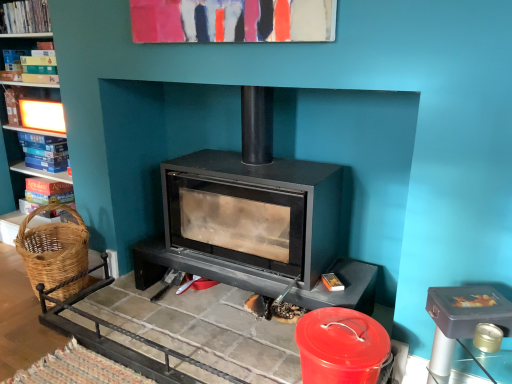
How much space does hardcover book at left, which is counted as the 4th book, starting from the bottom, occupy horizontally?

It is 4.35 inches.

Identify the location of woven brown basket at left. (53, 249).

This screenshot has width=512, height=384. Describe the element at coordinates (44, 152) in the screenshot. I see `blue cardboard book at left, the 2th book when ordered from bottom to top` at that location.

At what (x,y) coordinates should I click in order to perform the action: click on matte cardboard book at left, arranged as the first book when ordered from the bottom. Please return your answer as a coordinate pair (x, y). This screenshot has height=384, width=512. Looking at the image, I should click on (46, 192).

At what (x,y) coordinates should I click in order to perform the action: click on hardcover book at left, the 1th book viewed from the top. Please return your answer as a coordinate pair (x, y). Looking at the image, I should click on (26, 17).

Is matte cardboard book at left, arranged as the first book when ordered from the bottom, outside of blue cardboard book at left, which appears as the third book when viewed from the top?

Yes, matte cardboard book at left, arranged as the first book when ordered from the bottom, is outside of blue cardboard book at left, which appears as the third book when viewed from the top.

Relative to blue cardboard book at left, which appears as the third book when viewed from the top, is matte cardboard book at left, placed as the 4th book when sorted from top to bottom, in front or behind?

Visually, matte cardboard book at left, placed as the 4th book when sorted from top to bottom, is located behind blue cardboard book at left, which appears as the third book when viewed from the top.

Between matte cardboard book at left, arranged as the first book when ordered from the bottom, and blue cardboard book at left, the 2th book when ordered from bottom to top, which one has more height?

Standing taller between the two is blue cardboard book at left, the 2th book when ordered from bottom to top.

Is hardcover book at left, the 2th book viewed from the top, turned away from matte cardboard book at left, placed as the 4th book when sorted from top to bottom?

No, hardcover book at left, the 2th book viewed from the top,'s orientation is not away from matte cardboard book at left, placed as the 4th book when sorted from top to bottom.

Between hardcover book at left, the 2th book viewed from the top, and matte cardboard book at left, arranged as the first book when ordered from the bottom, which one has larger width?

matte cardboard book at left, arranged as the first book when ordered from the bottom, is wider.

Could matte cardboard book at left, placed as the 4th book when sorted from top to bottom, be considered to be inside hardcover book at left, the 2th book viewed from the top?

No, matte cardboard book at left, placed as the 4th book when sorted from top to bottom, is not a part of hardcover book at left, the 2th book viewed from the top.

Considering the relative sizes of hardcover book at left, the 2th book viewed from the top, and matte cardboard book at left, arranged as the first book when ordered from the bottom, in the image provided, is hardcover book at left, the 2th book viewed from the top, taller than matte cardboard book at left, arranged as the first book when ordered from the bottom,?

No.

From the image's perspective, is hardcover book at left, placed as the third book when sorted from bottom to top, located above or below hardcover book at left, which is counted as the 4th book, starting from the bottom?

From the image's perspective, hardcover book at left, placed as the third book when sorted from bottom to top, appears below hardcover book at left, which is counted as the 4th book, starting from the bottom.

Is hardcover book at left, the 1th book viewed from the top, a part of hardcover book at left, the 2th book viewed from the top?

No, hardcover book at left, the 1th book viewed from the top, is not surrounded by hardcover book at left, the 2th book viewed from the top.

Is hardcover book at left, the 2th book viewed from the top, in front of hardcover book at left, the 1th book viewed from the top?

No, hardcover book at left, the 2th book viewed from the top, is further to the viewer.

From a real-world perspective, is hardcover book at left, the 2th book viewed from the top, under hardcover book at left, which is counted as the 4th book, starting from the bottom?

Indeed, from a real-world perspective, hardcover book at left, the 2th book viewed from the top, is positioned beneath hardcover book at left, which is counted as the 4th book, starting from the bottom.

Consider the image. Is woven brown basket at left at the back of matte cardboard book at left, placed as the 4th book when sorted from top to bottom?

No.

From the image's perspective, between matte cardboard book at left, arranged as the first book when ordered from the bottom, and woven brown basket at left, which one is located above?

From the image's view, matte cardboard book at left, arranged as the first book when ordered from the bottom, is above.

How far apart are matte cardboard book at left, placed as the 4th book when sorted from top to bottom, and woven brown basket at left?

matte cardboard book at left, placed as the 4th book when sorted from top to bottom, is 55.04 centimeters from woven brown basket at left.

Is matte cardboard book at left, arranged as the first book when ordered from the bottom, completely or partially outside of woven brown basket at left?

matte cardboard book at left, arranged as the first book when ordered from the bottom, is positioned outside woven brown basket at left.

Is hardcover book at left, the 1th book viewed from the top, next to matte cardboard book at left, placed as the 4th book when sorted from top to bottom, and touching it?

No, hardcover book at left, the 1th book viewed from the top, is not in contact with matte cardboard book at left, placed as the 4th book when sorted from top to bottom.

Is hardcover book at left, the 1th book viewed from the top, looking in the opposite direction of matte cardboard book at left, placed as the 4th book when sorted from top to bottom?

No, hardcover book at left, the 1th book viewed from the top, is not facing away from matte cardboard book at left, placed as the 4th book when sorted from top to bottom.

Which is correct: hardcover book at left, which is counted as the 4th book, starting from the bottom, is inside matte cardboard book at left, arranged as the first book when ordered from the bottom, or outside of it?

hardcover book at left, which is counted as the 4th book, starting from the bottom, is not enclosed by matte cardboard book at left, arranged as the first book when ordered from the bottom.

From a real-world perspective, is hardcover book at left, which is counted as the 4th book, starting from the bottom, above or below matte cardboard book at left, arranged as the first book when ordered from the bottom?

In terms of real-world spatial position, hardcover book at left, which is counted as the 4th book, starting from the bottom, is above matte cardboard book at left, arranged as the first book when ordered from the bottom.

Is matte cardboard book at left, placed as the 4th book when sorted from top to bottom, facing away from hardcover book at left, which is counted as the 4th book, starting from the bottom?

No, matte cardboard book at left, placed as the 4th book when sorted from top to bottom,'s orientation is not away from hardcover book at left, which is counted as the 4th book, starting from the bottom.

What's the angular difference between matte cardboard book at left, arranged as the first book when ordered from the bottom, and hardcover book at left, the 1th book viewed from the top,'s facing directions?

They differ by 0.00179 degrees in their facing directions.

From the image's perspective, who appears lower, matte cardboard book at left, placed as the 4th book when sorted from top to bottom, or hardcover book at left, the 1th book viewed from the top?

matte cardboard book at left, placed as the 4th book when sorted from top to bottom, appears lower in the image.

Between hardcover book at left, the 2th book viewed from the top, and blue cardboard book at left, the 2th book when ordered from bottom to top, which one has less height?

Standing shorter between the two is hardcover book at left, the 2th book viewed from the top.

Is hardcover book at left, the 2th book viewed from the top, next to blue cardboard book at left, the 2th book when ordered from bottom to top?

There is a gap between hardcover book at left, the 2th book viewed from the top, and blue cardboard book at left, the 2th book when ordered from bottom to top.

Would you say hardcover book at left, placed as the third book when sorted from bottom to top, is outside blue cardboard book at left, which appears as the third book when viewed from the top?

Indeed, hardcover book at left, placed as the third book when sorted from bottom to top, is completely outside blue cardboard book at left, which appears as the third book when viewed from the top.

Where is `book behind the blue cardboard book at left, the 2th book when ordered from bottom to top`? This screenshot has width=512, height=384. book behind the blue cardboard book at left, the 2th book when ordered from bottom to top is located at coordinates (46, 192).

From the image's perspective, starting from the hardcover book at left, the 2th book viewed from the top, which book is the 2nd one below? Please provide its 2D coordinates.

[(46, 192)]

When comparing their distances from matte cardboard book at left, arranged as the first book when ordered from the bottom, does hardcover book at left, placed as the third book when sorted from bottom to top, or blue cardboard book at left, which appears as the third book when viewed from the top, seem further?

The object further to matte cardboard book at left, arranged as the first book when ordered from the bottom, is hardcover book at left, placed as the third book when sorted from bottom to top.

Estimate the real-world distances between objects in this image. Which object is further from hardcover book at left, placed as the third book when sorted from bottom to top, woven brown basket at left or hardcover book at left, the 1th book viewed from the top?

Among the two, woven brown basket at left is located further to hardcover book at left, placed as the third book when sorted from bottom to top.

When comparing their distances from matte cardboard book at left, arranged as the first book when ordered from the bottom, does hardcover book at left, which is counted as the 4th book, starting from the bottom, or woven brown basket at left seem further?

hardcover book at left, which is counted as the 4th book, starting from the bottom, is further to matte cardboard book at left, arranged as the first book when ordered from the bottom.

Estimate the real-world distances between objects in this image. Which object is closer to hardcover book at left, which is counted as the 4th book, starting from the bottom, matte cardboard book at left, arranged as the first book when ordered from the bottom, or hardcover book at left, the 2th book viewed from the top?

hardcover book at left, the 2th book viewed from the top, lies closer to hardcover book at left, which is counted as the 4th book, starting from the bottom, than the other object.

Which object lies further to the anchor point hardcover book at left, the 1th book viewed from the top, woven brown basket at left or matte cardboard book at left, arranged as the first book when ordered from the bottom?

The object further to hardcover book at left, the 1th book viewed from the top, is woven brown basket at left.

Looking at the image, which one is located closer to hardcover book at left, placed as the third book when sorted from bottom to top, hardcover book at left, the 1th book viewed from the top, or matte cardboard book at left, placed as the 4th book when sorted from top to bottom?

Based on the image, hardcover book at left, the 1th book viewed from the top, appears to be nearer to hardcover book at left, placed as the third book when sorted from bottom to top.

When comparing their distances from hardcover book at left, the 1th book viewed from the top, does hardcover book at left, placed as the third book when sorted from bottom to top, or woven brown basket at left seem closer?

hardcover book at left, placed as the third book when sorted from bottom to top, lies closer to hardcover book at left, the 1th book viewed from the top, than the other object.

Estimate the real-world distances between objects in this image. Which object is further from hardcover book at left, placed as the third book when sorted from bottom to top, woven brown basket at left or matte cardboard book at left, placed as the 4th book when sorted from top to bottom?

Based on the image, woven brown basket at left appears to be further to hardcover book at left, placed as the third book when sorted from bottom to top.

The image size is (512, 384). I want to click on book that lies between hardcover book at left, the 1th book viewed from the top, and blue cardboard book at left, the 2th book when ordered from bottom to top, from top to bottom, so click(30, 65).

This screenshot has height=384, width=512. I want to click on book between hardcover book at left, placed as the third book when sorted from bottom to top, and matte cardboard book at left, arranged as the first book when ordered from the bottom, from top to bottom, so click(44, 152).